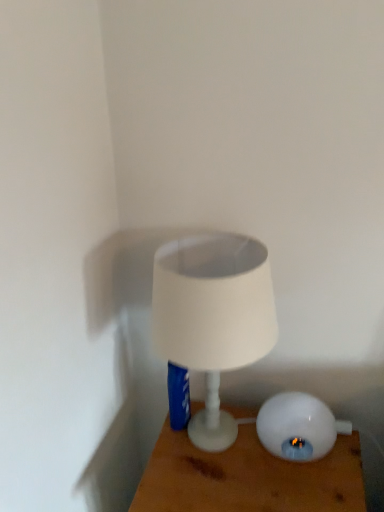
The image size is (384, 512). I want to click on free space in front of white glossy lamp at lower right, the first lamp in the right-to-left sequence, so click(x=299, y=486).